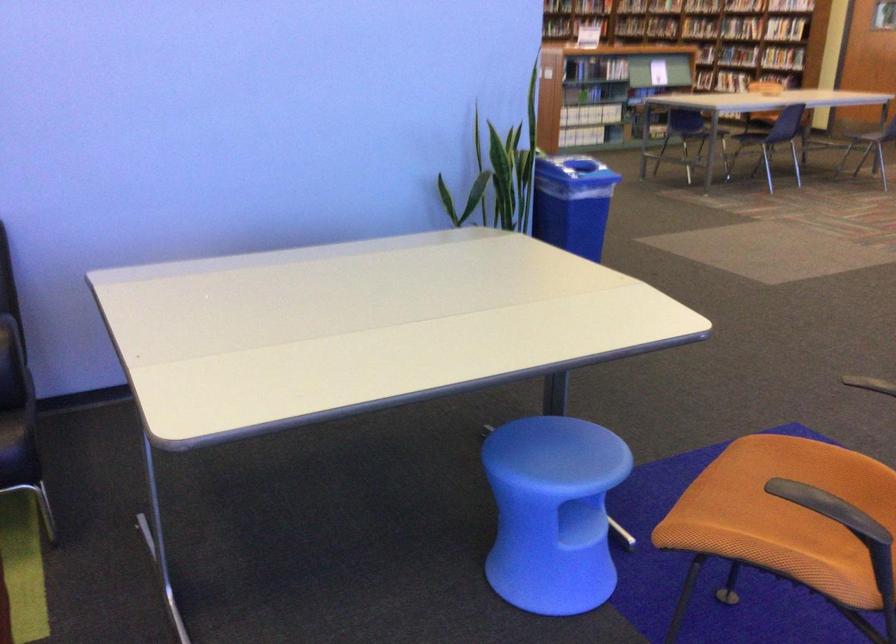
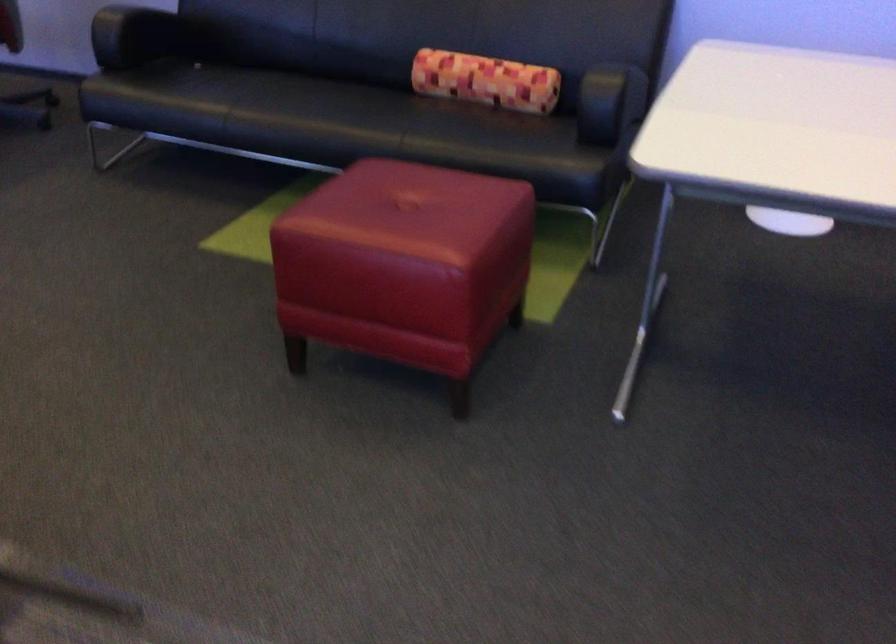
The images are taken continuously from a first-person perspective. In which direction is your viewpoint rotating?

The camera rotated toward left-down.